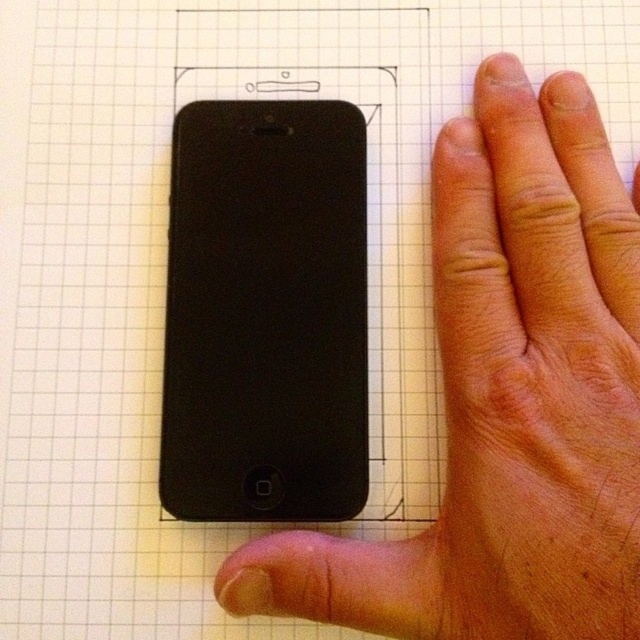
You are an engineer measuring the distance between two matte black devices in the image. The scene has a graph paper background with a grid. Can you confirm if the distance between the matte black phone at left and the matte black smartphone at center is more than 5 inches?

The matte black phone at left is 5.27 inches away from matte black smartphone at center, so the distance is more than 5 inches.

You are a designer trying to create a template for a phone case. You have the matte black phone at left and the matte black smartphone at center in front of you. Which phone should you use as the reference for the case design if you want the case to fit the one that is placed higher on the graph paper?

The matte black phone at left is positioned under the matte black smartphone at center, so the smartphone at center is higher. Therefore, you should use the matte black smartphone at center as the reference for the case design to fit the one placed higher on the graph paper.